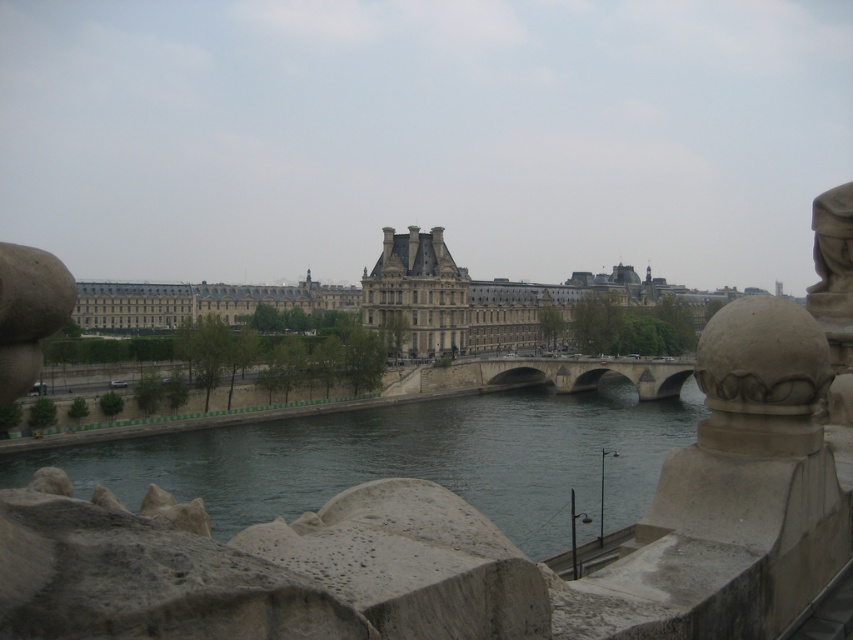
Who is shorter, green stone river at center or smooth stone statue at upper right?

With less height is green stone river at center.

Which is more to the right, green stone river at center or smooth stone statue at upper right?

From the viewer's perspective, smooth stone statue at upper right appears more on the right side.

The image size is (853, 640). Identify the location of green stone river at center. (408, 458).

Does beige stone palace at center have a smaller size compared to smooth stone sculpture at left?

Actually, beige stone palace at center might be larger than smooth stone sculpture at left.

Who is positioned more to the right, beige stone palace at center or smooth stone sculpture at left?

From the viewer's perspective, beige stone palace at center appears more on the right side.

Which is behind, point (88, 316) or point (25, 291)?

Point (88, 316)

The image size is (853, 640). In order to click on beige stone palace at center in this screenshot , I will do `click(390, 298)`.

Who is taller, smooth stone sculpture at left or stone bridge at center?

With more height is stone bridge at center.

The width and height of the screenshot is (853, 640). What do you see at coordinates (28, 312) in the screenshot?
I see `smooth stone sculpture at left` at bounding box center [28, 312].

Which is in front, point (67, 292) or point (596, 358)?

Positioned in front is point (67, 292).

At what (x,y) coordinates should I click in order to perform the action: click on smooth stone sculpture at left. Please return your answer as a coordinate pair (x, y). Image resolution: width=853 pixels, height=640 pixels. Looking at the image, I should click on (28, 312).